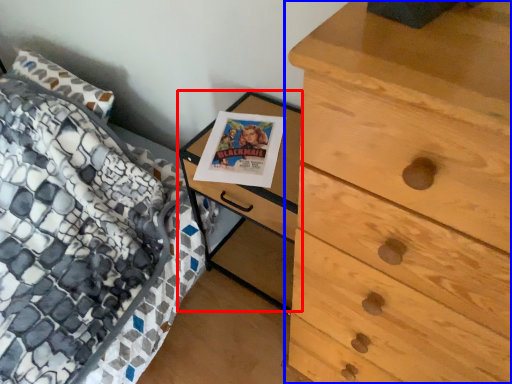
Question: Which object is further to the camera taking this photo, nightstand (highlighted by a red box) or chest of drawers (highlighted by a blue box)?

Choices:
 (A) nightstand
 (B) chest of drawers

Answer: (A)